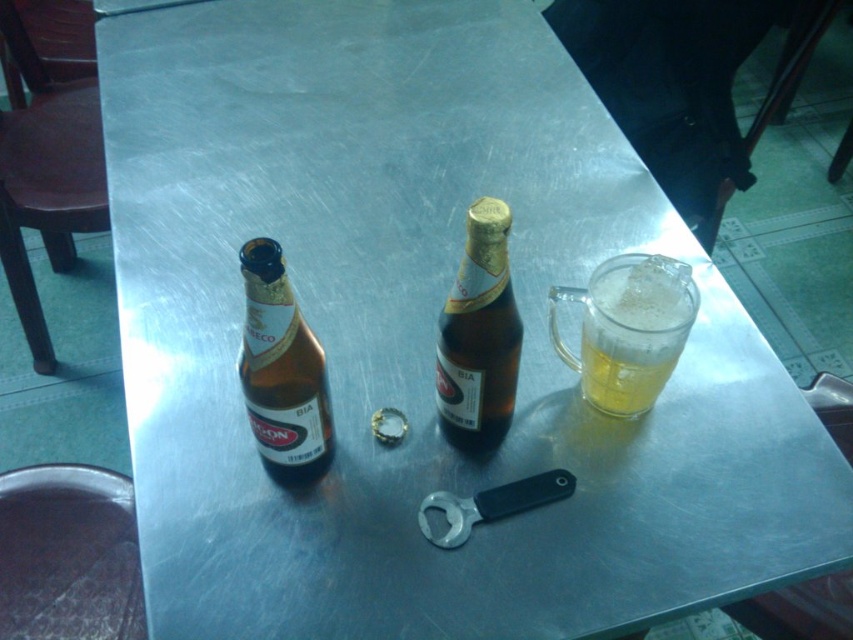
This screenshot has height=640, width=853. Describe the element at coordinates (628, 330) in the screenshot. I see `translucent glass mug at right` at that location.

Is translucent glass mug at right to the left of brown glass bottle at left from the viewer's perspective?

Incorrect, translucent glass mug at right is not on the left side of brown glass bottle at left.

You are a GUI agent. You are given a task and a screenshot of the screen. Output one action in this format:
    pyautogui.click(x=<x>, y=<y>)
    Task: Click on the translucent glass mug at right
    The height and width of the screenshot is (640, 853).
    Given the screenshot: What is the action you would take?
    pyautogui.click(x=628, y=330)

Looking at this image, who is lower down, brown glass bottle at center or brown glass bottle at left?

brown glass bottle at left is lower down.

Does brown glass bottle at center have a smaller size compared to brown glass bottle at left?

No, brown glass bottle at center is not smaller than brown glass bottle at left.

Is point (488, 304) positioned in front of point (251, 387)?

Yes, point (488, 304) is closer to viewer.

Find the location of a particular element. brown glass bottle at center is located at coordinates point(479,333).

Which is more to the left, translucent glass mug at right or brown glass bottle at center?

brown glass bottle at center

Is point (573, 358) positioned behind point (491, 214)?

Yes, point (573, 358) is behind point (491, 214).

Identify the location of translucent glass mug at right. The image size is (853, 640). (628, 330).